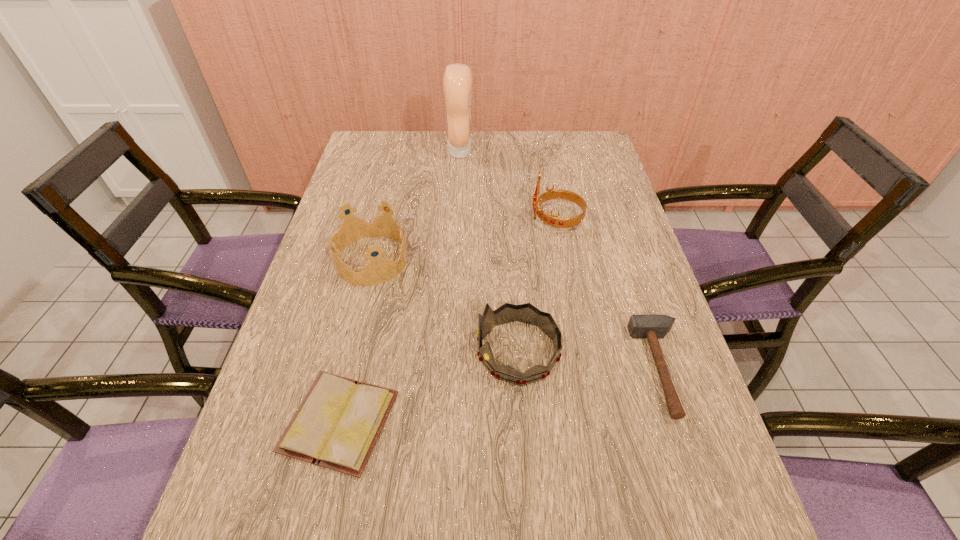
The height and width of the screenshot is (540, 960). In order to click on the tallest object in this screenshot , I will do pyautogui.click(x=457, y=80).

Where is `the farthest object`? The width and height of the screenshot is (960, 540). the farthest object is located at coordinates (457, 80).

The image size is (960, 540). Find the location of `the farthest tiara`. the farthest tiara is located at coordinates (553, 220).

In order to click on the fifth nearest object in this screenshot , I will do `click(553, 220)`.

Locate an element on the screen. The width and height of the screenshot is (960, 540). the nearest tiara is located at coordinates (526, 313).

Locate an element on the screen. The width and height of the screenshot is (960, 540). the third farthest object is located at coordinates (379, 270).

Locate an element on the screen. The image size is (960, 540). the second farthest tiara is located at coordinates (379, 270).

Locate an element on the screen. hammer is located at coordinates (651, 327).

Find the location of a particular element. the second shortest object is located at coordinates (651, 327).

Where is `diary`? This screenshot has height=540, width=960. diary is located at coordinates (337, 425).